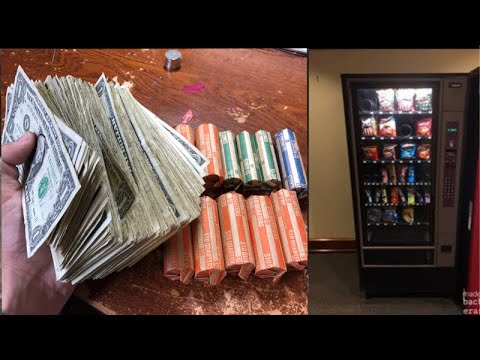
Image resolution: width=480 pixels, height=360 pixels. I want to click on table, so click(234, 82).